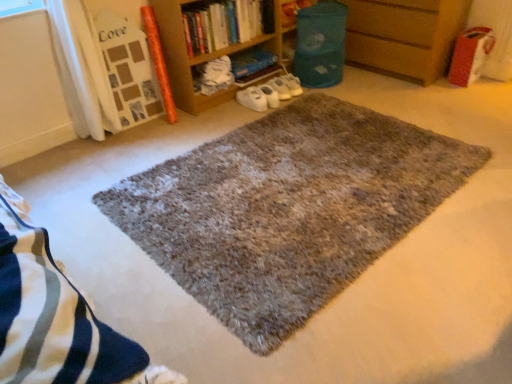
Image resolution: width=512 pixels, height=384 pixels. What do you see at coordinates (251, 62) in the screenshot?
I see `hardcover book at center, marked as the second book in a front-to-back arrangement` at bounding box center [251, 62].

Measure the distance between shaggy gray rug at center and camera.

shaggy gray rug at center is 1.38 meters away from camera.

The height and width of the screenshot is (384, 512). I want to click on hardcover book at upper center, the second book from the back, so click(x=226, y=24).

Is hardcover book at upper center, which ranks as the 1th book in front-to-back order, at the left side of shaggy gray rug at center?

Correct, you'll find hardcover book at upper center, which ranks as the 1th book in front-to-back order, to the left of shaggy gray rug at center.

Is hardcover book at upper center, which ranks as the 1th book in front-to-back order, further to camera compared to shaggy gray rug at center?

Yes, hardcover book at upper center, which ranks as the 1th book in front-to-back order, is behind shaggy gray rug at center.

From a real-world perspective, who is located lower, hardcover book at upper center, which ranks as the 1th book in front-to-back order, or shaggy gray rug at center?

shaggy gray rug at center.

Identify the location of the 2nd book above the shaggy gray rug at center (from the image's perspective). The image size is (512, 384). (226, 24).

Consider the image. Does wooden at right have a larger size compared to white matte shoes at center?

Yes.

From a real-world perspective, is wooden at right below white matte shoes at center?

No, from a real-world perspective, wooden at right is not beneath white matte shoes at center.

Which is behind, point (406, 14) or point (281, 85)?

Positioned behind is point (281, 85).

This screenshot has width=512, height=384. I want to click on shelf located in front of the white matte shoes at center, so pyautogui.click(x=404, y=36).

Based on the photo, from the image's perspective, is brown wooden bookcase at upper center above or below white matte shoes at center?

brown wooden bookcase at upper center is situated higher than white matte shoes at center in the image.

Is brown wooden bookcase at upper center aimed at white matte shoes at center?

Yes, brown wooden bookcase at upper center is oriented towards white matte shoes at center.

I want to click on shoe located on the right of brown wooden bookcase at upper center, so click(270, 93).

Between brown wooden bookcase at upper center and white matte shoes at center, which one has less height?

white matte shoes at center is shorter.

Is the surface of wooden at right in direct contact with shaggy gray rug at center?

There is a gap between wooden at right and shaggy gray rug at center.

Is point (462, 8) closer to camera compared to point (195, 289)?

No.

From a real-world perspective, which is physically below, wooden at right or shaggy gray rug at center?

shaggy gray rug at center, from a real-world perspective.

Is point (184, 77) behind point (257, 145)?

Yes.

Considering the relative sizes of brown wooden bookcase at upper center and shaggy gray rug at center in the image provided, is brown wooden bookcase at upper center wider than shaggy gray rug at center?

In fact, brown wooden bookcase at upper center might be narrower than shaggy gray rug at center.

Identify the location of bookcase above the shaggy gray rug at center (from the image's perspective). This screenshot has width=512, height=384. (218, 42).

Considering the relative positions of brown wooden bookcase at upper center and shaggy gray rug at center in the image provided, is brown wooden bookcase at upper center to the left of shaggy gray rug at center from the viewer's perspective?

Correct, you'll find brown wooden bookcase at upper center to the left of shaggy gray rug at center.

Is point (252, 74) farther from camera compared to point (210, 17)?

Yes, it is.

From the image's perspective, does hardcover book at center, the 1th book in the back-to-front sequence, appear lower than hardcover book at upper center, the second book from the back?

Yes.

Based on the photo, how many degrees apart are the facing directions of hardcover book at center, the 1th book in the back-to-front sequence, and hardcover book at upper center, the second book from the back?

0.412 degrees separate the facing orientations of hardcover book at center, the 1th book in the back-to-front sequence, and hardcover book at upper center, the second book from the back.

The image size is (512, 384). In order to click on book to the right of hardcover book at upper center, which ranks as the 1th book in front-to-back order in this screenshot , I will do `click(251, 62)`.

Which of these two, hardcover book at upper center, which ranks as the 1th book in front-to-back order, or brown wooden bookcase at upper center, is wider?

brown wooden bookcase at upper center.

Between hardcover book at upper center, which ranks as the 1th book in front-to-back order, and brown wooden bookcase at upper center, which one has less height?

With less height is hardcover book at upper center, which ranks as the 1th book in front-to-back order.

Does point (272, 20) come closer to viewer compared to point (192, 30)?

No, (272, 20) is behind (192, 30).

From the image's perspective, count 2nd books upward from the shaggy gray rug at center and point to it. Please provide its 2D coordinates.

[(226, 24)]

This screenshot has width=512, height=384. Find the location of `shelf in front of the white matte shoes at center`. shelf in front of the white matte shoes at center is located at coordinates (404, 36).

When comparing their distances from hardcover book at upper center, the second book from the back, does wooden at right or hardcover book at center, marked as the second book in a front-to-back arrangement, seem further?

wooden at right lies further to hardcover book at upper center, the second book from the back, than the other object.

Estimate the real-world distances between objects in this image. Which object is closer to hardcover book at upper center, which ranks as the 1th book in front-to-back order, wooden at right or shaggy gray rug at center?

Based on the image, wooden at right appears to be nearer to hardcover book at upper center, which ranks as the 1th book in front-to-back order.

Considering their positions, is brown wooden bookcase at upper center positioned further to hardcover book at upper center, which ranks as the 1th book in front-to-back order, than white matte shoes at center?

Based on the image, white matte shoes at center appears to be further to hardcover book at upper center, which ranks as the 1th book in front-to-back order.

Based on their spatial positions, is hardcover book at upper center, which ranks as the 1th book in front-to-back order, or wooden at right closer to hardcover book at center, the 1th book in the back-to-front sequence?

Based on the image, hardcover book at upper center, which ranks as the 1th book in front-to-back order, appears to be nearer to hardcover book at center, the 1th book in the back-to-front sequence.

Based on their spatial positions, is white matte shoes at center or brown wooden bookcase at upper center further from shaggy gray rug at center?

Based on the image, brown wooden bookcase at upper center appears to be further to shaggy gray rug at center.

From the image, which object appears to be nearer to hardcover book at upper center, which ranks as the 1th book in front-to-back order, wooden at right or brown wooden bookcase at upper center?

brown wooden bookcase at upper center lies closer to hardcover book at upper center, which ranks as the 1th book in front-to-back order, than the other object.

Looking at the image, which one is located further to wooden at right, white matte shoes at center or hardcover book at upper center, which ranks as the 1th book in front-to-back order?

hardcover book at upper center, which ranks as the 1th book in front-to-back order.

From the picture: Based on their spatial positions, is hardcover book at upper center, the second book from the back, or shaggy gray rug at center closer to white matte shoes at center?

hardcover book at upper center, the second book from the back, is closer to white matte shoes at center.

You are a GUI agent. You are given a task and a screenshot of the screen. Output one action in this format:
    pyautogui.click(x=<x>, y=<y>)
    Task: Click on the bookcase between shaggy gray rug at center and white matte shoes at center along the z-axis
    This screenshot has width=512, height=384.
    Given the screenshot: What is the action you would take?
    pyautogui.click(x=218, y=42)

Where is `book situated between brown wooden bookcase at upper center and wooden at right from left to right`? Image resolution: width=512 pixels, height=384 pixels. book situated between brown wooden bookcase at upper center and wooden at right from left to right is located at coordinates (251, 62).

Locate an element on the screen. Image resolution: width=512 pixels, height=384 pixels. shoe between shaggy gray rug at center and hardcover book at center, the 1th book in the back-to-front sequence, in the front-back direction is located at coordinates (270, 93).

Image resolution: width=512 pixels, height=384 pixels. I want to click on shelf positioned between shaggy gray rug at center and hardcover book at center, marked as the second book in a front-to-back arrangement, from near to far, so [404, 36].